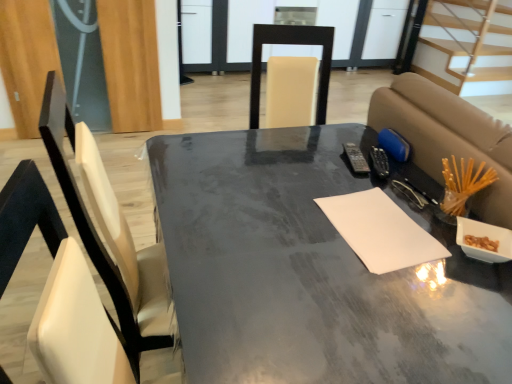
Question: Should I look upward or downward to see white paper at center?

Choices:
 (A) up
 (B) down

Answer: (B)

Question: Is light wood stairs at upper right wider than matte gray table at center?

Choices:
 (A) yes
 (B) no

Answer: (A)

Question: Is light wood stairs at upper right positioned far away from matte gray table at center?

Choices:
 (A) yes
 (B) no

Answer: (A)

Question: Is light wood stairs at upper right closer to the viewer compared to matte gray table at center?

Choices:
 (A) yes
 (B) no

Answer: (B)

Question: Does light wood stairs at upper right have a lesser height compared to matte gray table at center?

Choices:
 (A) no
 (B) yes

Answer: (B)

Question: From the image's perspective, is light wood stairs at upper right located beneath matte gray table at center?

Choices:
 (A) yes
 (B) no

Answer: (B)

Question: Can you confirm if light wood stairs at upper right is positioned to the right of matte gray table at center?

Choices:
 (A) yes
 (B) no

Answer: (A)

Question: Does matte gray table at center have a lesser width compared to light wood stairs at upper right?

Choices:
 (A) yes
 (B) no

Answer: (A)

Question: Considering the relative positions of matte gray table at center and light wood stairs at upper right in the image provided, is matte gray table at center to the left of light wood stairs at upper right from the viewer's perspective?

Choices:
 (A) yes
 (B) no

Answer: (A)

Question: Is matte gray table at center taller than light wood stairs at upper right?

Choices:
 (A) no
 (B) yes

Answer: (B)

Question: Would you say matte gray table at center is outside light wood stairs at upper right?

Choices:
 (A) yes
 (B) no

Answer: (A)

Question: Is matte gray table at center bigger than light wood stairs at upper right?

Choices:
 (A) no
 (B) yes

Answer: (B)

Question: Is matte gray table at center facing away from light wood stairs at upper right?

Choices:
 (A) no
 (B) yes

Answer: (A)

Question: Is matte gray table at center next to white paper at center?

Choices:
 (A) yes
 (B) no

Answer: (B)